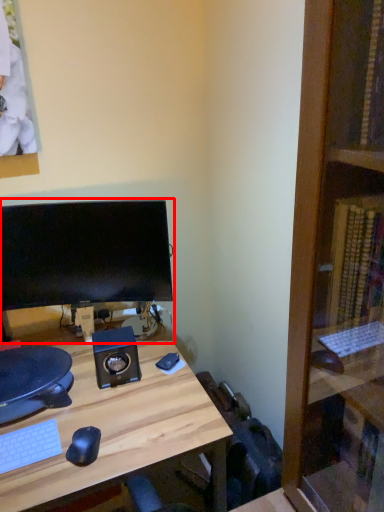
Question: From the image's perspective, what is the correct spatial positioning of computer monitor (annotated by the red box) in reference to desk?

Choices:
 (A) above
 (B) below

Answer: (A)